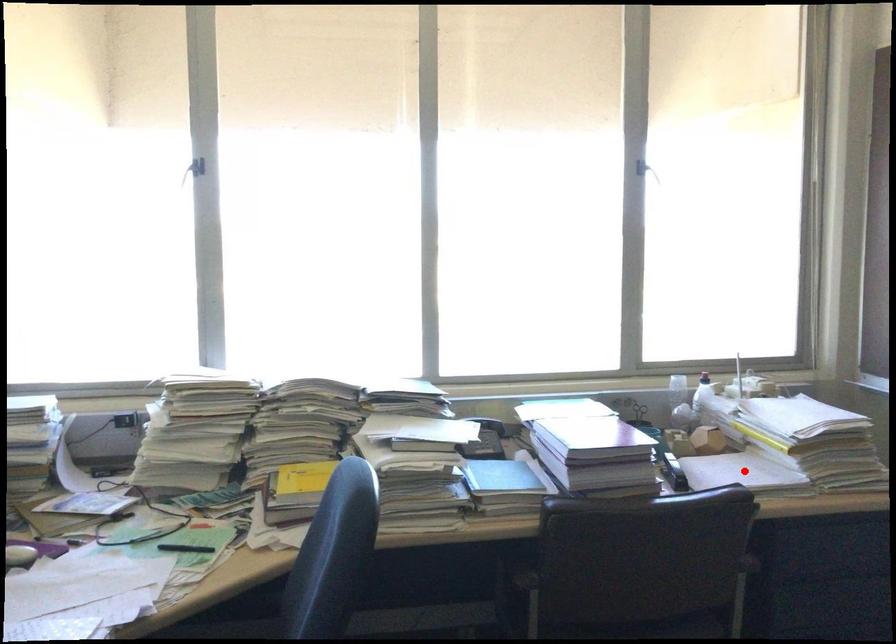
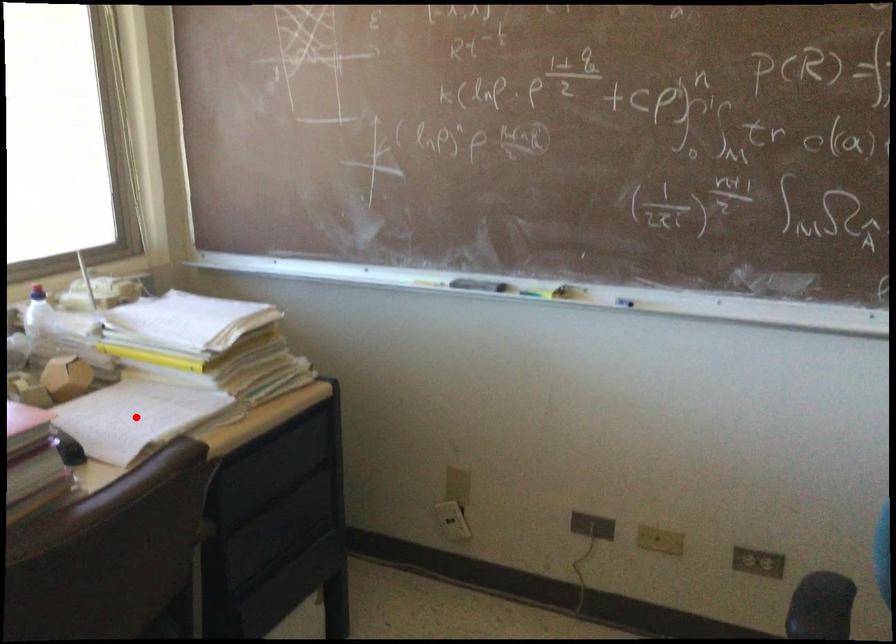
I am providing you with two images of the same scene from different viewpoints. A red point is marked on the first image and another point is marked on the second image. Is the marked point in image1 the same physical position as the marked point in image2?

Yes